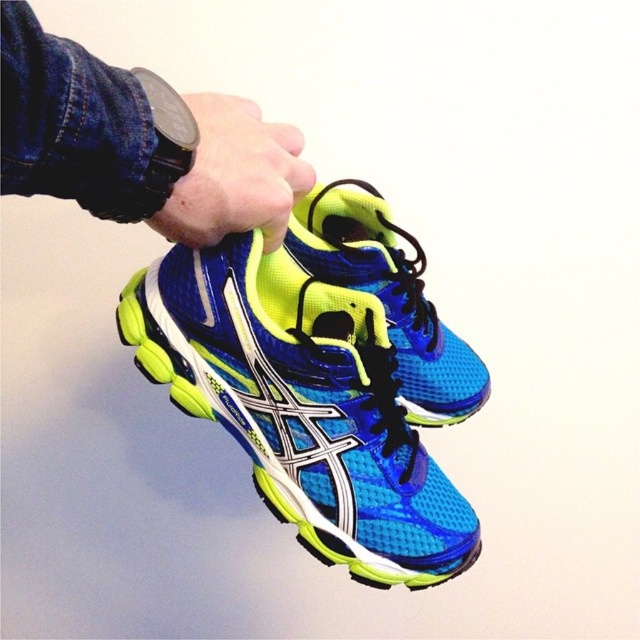
Question: Considering the relative positions of blue mesh running shoe at center and black watch at upper center in the image provided, where is blue mesh running shoe at center located with respect to black watch at upper center?

Choices:
 (A) left
 (B) right

Answer: (B)

Question: Which is farther from the black watch at upper center?

Choices:
 (A) blue mesh running shoe at center
 (B) black rubber wristwatch at upper center

Answer: (A)

Question: Is black watch at upper center below black rubber wristwatch at upper center?

Choices:
 (A) no
 (B) yes

Answer: (A)

Question: Among these objects, which one is farthest from the camera?

Choices:
 (A) black watch at upper center
 (B) black rubber wristwatch at upper center
 (C) blue mesh running shoe at center

Answer: (C)

Question: Which point appears closest to the camera in this image?

Choices:
 (A) (157, 129)
 (B) (266, 198)
 (C) (397, 474)

Answer: (A)

Question: Is black watch at upper center wider than black rubber wristwatch at upper center?

Choices:
 (A) no
 (B) yes

Answer: (B)